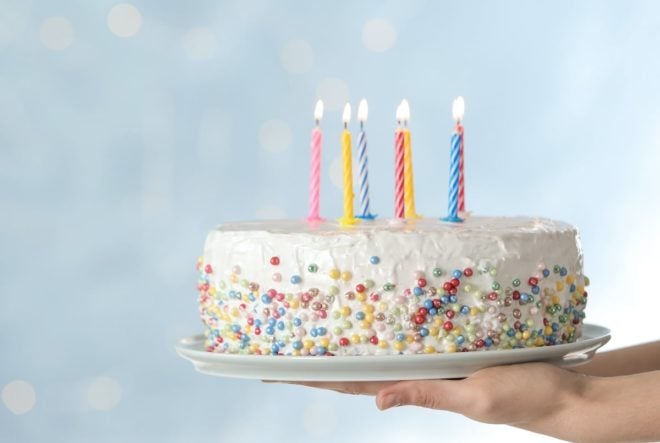
The image size is (660, 443). I want to click on birthday candle, so click(x=463, y=175), click(x=453, y=185), click(x=412, y=185), click(x=397, y=182), click(x=370, y=172), click(x=348, y=175), click(x=315, y=170).